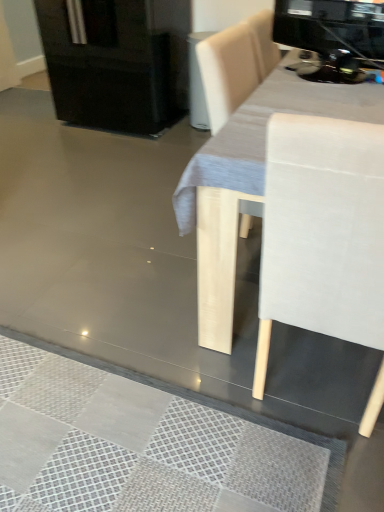
Question: Considering the relative positions of black glossy fridge at upper left and black glossy coffee machine at upper right in the image provided, is black glossy fridge at upper left to the left or to the right of black glossy coffee machine at upper right?

Choices:
 (A) left
 (B) right

Answer: (A)

Question: Does point (71, 37) appear closer or farther from the camera than point (327, 15)?

Choices:
 (A) closer
 (B) farther

Answer: (B)

Question: From their relative heights in the image, would you say black glossy fridge at upper left is taller or shorter than black glossy coffee machine at upper right?

Choices:
 (A) short
 (B) tall

Answer: (B)

Question: Is point (382, 16) positioned closer to the camera than point (62, 96)?

Choices:
 (A) farther
 (B) closer

Answer: (B)

Question: Relative to black glossy fridge at upper left, is black glossy coffee machine at upper right in front or behind?

Choices:
 (A) behind
 (B) front

Answer: (B)

Question: From a real-world perspective, is black glossy coffee machine at upper right positioned above or below black glossy fridge at upper left?

Choices:
 (A) above
 (B) below

Answer: (A)

Question: In terms of height, does black glossy coffee machine at upper right look taller or shorter compared to black glossy fridge at upper left?

Choices:
 (A) short
 (B) tall

Answer: (A)